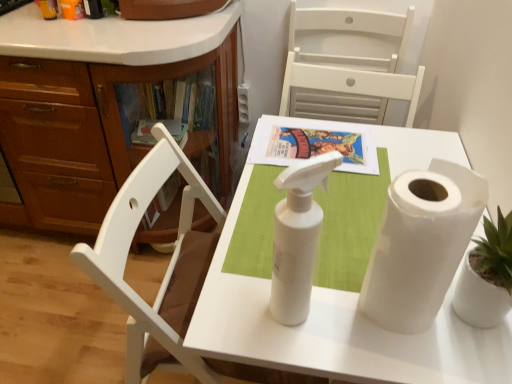
Where is `free space in front of matte paper book at center`? This screenshot has height=384, width=512. free space in front of matte paper book at center is located at coordinates (320, 204).